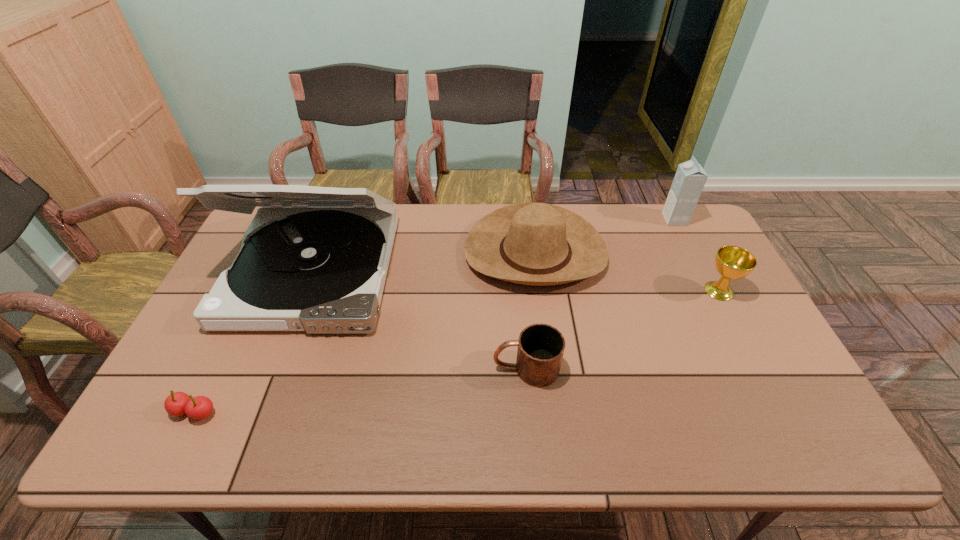
This screenshot has height=540, width=960. What are the coordinates of `the tallest object` in the screenshot? It's located at (315, 259).

Locate an element on the screen. the fifth shortest object is located at coordinates (690, 178).

Image resolution: width=960 pixels, height=540 pixels. I want to click on cowboy hat, so click(x=538, y=244).

I want to click on chalice, so click(x=732, y=262).

The width and height of the screenshot is (960, 540). Identify the location of the second shortest object. (540, 350).

This screenshot has height=540, width=960. In order to click on the second nearest object in this screenshot , I will do `click(540, 350)`.

In order to click on cherry in this screenshot , I will do `click(178, 403)`.

This screenshot has width=960, height=540. Identify the location of the nearest object. (178, 403).

I want to click on vacant space located on the control panel of the tallest object, so click(253, 427).

You are a GUI agent. You are given a task and a screenshot of the screen. Output one action in this format:
    pyautogui.click(x=<x>, y=<y>)
    Task: Click on the blank area located on the front label of the carton
    
    Given the screenshot: What is the action you would take?
    pyautogui.click(x=617, y=219)